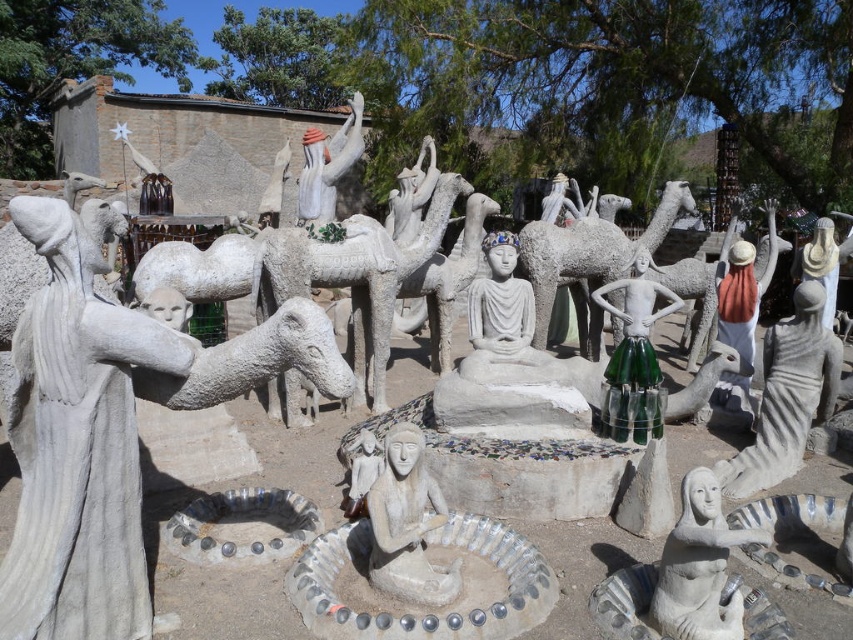
Question: Which of the following is the closest to the observer?

Choices:
 (A) (614, 365)
 (B) (401, 528)
 (C) (67, 214)

Answer: (C)

Question: Is green glass skirt at center below white stone figure at center?

Choices:
 (A) no
 (B) yes

Answer: (B)

Question: Which of these objects is positioned closest to the white stone statue at lower right?

Choices:
 (A) green glass skirt at center
 (B) white stone figure at center
 (C) white stone statue at left
 (D) smooth gray statue at right

Answer: (D)

Question: Which of the following is the closest to the observer?

Choices:
 (A) (757, 442)
 (B) (701, 627)
 (C) (399, 595)

Answer: (B)

Question: Does smooth gray statue at right have a lesser width compared to white stone statue at lower right?

Choices:
 (A) yes
 (B) no

Answer: (B)

Question: Can you confirm if smooth stone statue at center is bigger than white stone figure at center?

Choices:
 (A) no
 (B) yes

Answer: (A)